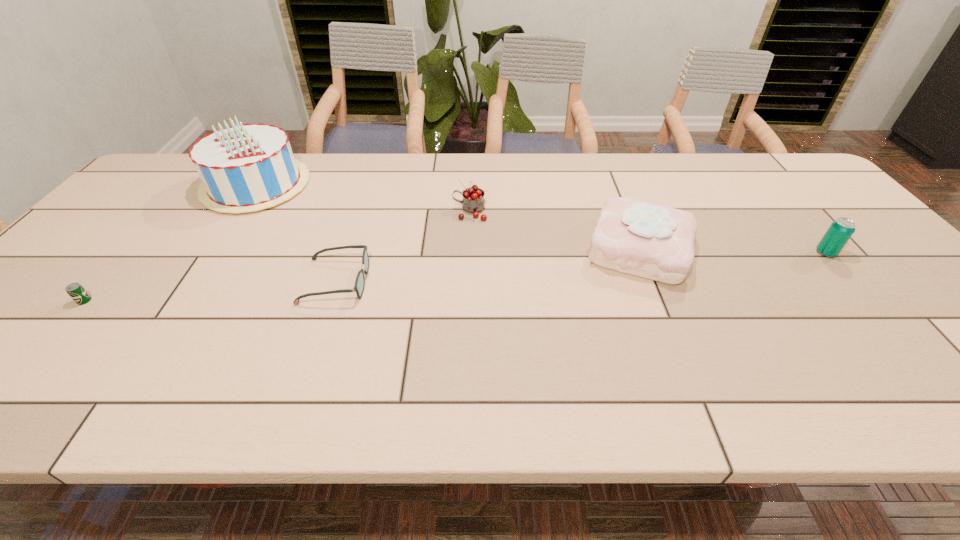
Find the location of a particular element. The height and width of the screenshot is (540, 960). vacant space located on the handle side of the third object from right to left is located at coordinates (383, 212).

The image size is (960, 540). What are the coordinates of `vacant space situated on the handle side of the third object from right to left` in the screenshot? It's located at (387, 212).

The image size is (960, 540). Find the location of `vacant space located 0.210m on the handle side of the third object from right to left`. vacant space located 0.210m on the handle side of the third object from right to left is located at coordinates (380, 212).

The width and height of the screenshot is (960, 540). I want to click on vacant space located 0.170m on the left of the taller beer can, so click(751, 253).

I want to click on free space located on the face of the fourth object from right to left, so click(446, 281).

The width and height of the screenshot is (960, 540). What are the coordinates of `blank space located 0.390m on the back of the shorter beer can` in the screenshot? It's located at click(175, 198).

Find the location of a particular element. Image resolution: width=960 pixels, height=540 pixels. object positioned at the far edge is located at coordinates (244, 168).

The image size is (960, 540). Find the location of `object located at the left edge`. object located at the left edge is located at coordinates pyautogui.click(x=76, y=291).

Where is `object located in the right edge section of the desktop`? object located in the right edge section of the desktop is located at coordinates (840, 231).

In the image, there is a desktop. Identify the location of vacant space at the far edge. (403, 166).